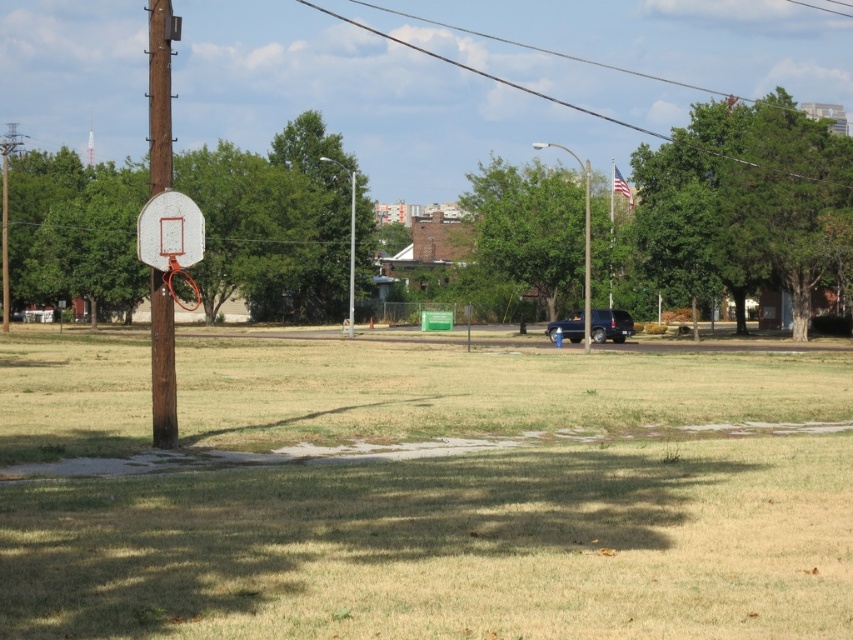
You are standing in the park and want to walk to the basketball hoop located at the center. The dry grass at center is in your way. If your stride length is 0.75 meters, how many steps will it take you to reach the basketball hoop?

The distance between you and the dry grass at center is 6.94 meters. With each step covering 0.75 meters, dividing 6.94 by 0.75 gives approximately 9.25 steps. Since you can only take whole steps, you would need to take 10 steps to reach the basketball hoop.

From the picture: You are planning to plant a new tree in this park. Considering the existing green leafy tree at left and the green leafy tree at upper right, which one would require more space due to its size?

The green leafy tree at left requires more space because it is bigger than the green leafy tree at upper right.

In the scene shown: You are standing at the basketball hoop attached to a wooden pole in the park. If you face towards the blue pickup truck parked near the fence, which direction should you turn to see the green leafy tree at upper right?

The green leafy tree at upper right is located at coordinates point (744, 202), which would be to your upper right direction when facing the blue pickup truck. Therefore, you should turn to your upper right to see the green leafy tree at upper right.